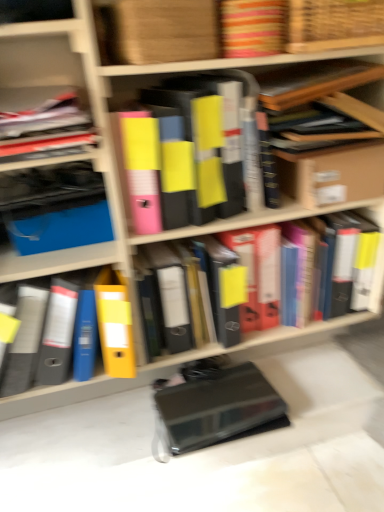
Question: From a real-world perspective, relative to yellow matte folder at center, acting as the 4th book starting from the top, is yellow matte folder at center, the 1th book in the bottom-to-top sequence, vertically above or below?

Choices:
 (A) above
 (B) below

Answer: (B)

Question: From the image's perspective, is yellow matte folder at center, the 1th book in the bottom-to-top sequence, positioned above or below yellow matte folder at center, acting as the 4th book starting from the top?

Choices:
 (A) above
 (B) below

Answer: (B)

Question: Which of these objects is positioned farthest from the woven wood basket at upper center?

Choices:
 (A) black matte book at lower center
 (B) striped fabric book at upper center, acting as the fifth book starting from the bottom
 (C) yellow matte folder at center, which ranks as the 2th book in bottom-to-top order
 (D) cardboard box at upper right
 (E) wooden frame at upper right, marked as the 4th book in a bottom-to-top arrangement

Answer: (A)

Question: Considering the real-world distances, which object is closest to the yellow matte folder at center, acting as the 4th book starting from the top?

Choices:
 (A) yellow matte folder at center, which is the fifth book from top to bottom
 (B) black matte book at lower center
 (C) wooden frame at upper right, marked as the 4th book in a bottom-to-top arrangement
 (D) striped fabric book at upper center, marked as the first book in a top-to-bottom arrangement
 (E) yellow matte folder at center, which is the third book from top to bottom

Answer: (B)